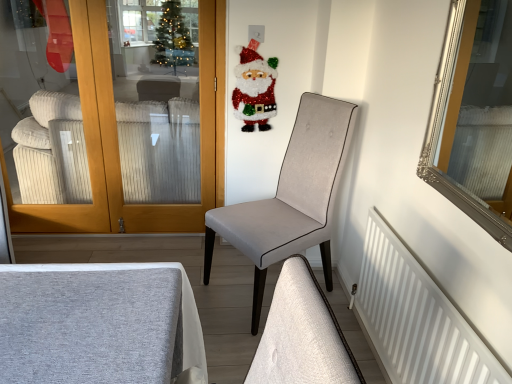
Question: Considering the relative sizes of white ribbed fabric couch at left and silver/glass mirror at upper right in the image provided, is white ribbed fabric couch at left taller than silver/glass mirror at upper right?

Choices:
 (A) no
 (B) yes

Answer: (B)

Question: Is the position of white ribbed fabric couch at left more distant than that of silver/glass mirror at upper right?

Choices:
 (A) yes
 (B) no

Answer: (A)

Question: Is white ribbed fabric couch at left at the left side of silver/glass mirror at upper right?

Choices:
 (A) yes
 (B) no

Answer: (A)

Question: Is white ribbed fabric couch at left smaller than silver/glass mirror at upper right?

Choices:
 (A) no
 (B) yes

Answer: (A)

Question: From the image's perspective, is white ribbed fabric couch at left below silver/glass mirror at upper right?

Choices:
 (A) yes
 (B) no

Answer: (B)

Question: Is white ribbed fabric couch at left beside silver/glass mirror at upper right?

Choices:
 (A) yes
 (B) no

Answer: (B)

Question: From a real-world perspective, is white matte radiator at lower right beneath silver/glass mirror at upper right?

Choices:
 (A) no
 (B) yes

Answer: (B)

Question: Does white matte radiator at lower right have a larger size compared to silver/glass mirror at upper right?

Choices:
 (A) yes
 (B) no

Answer: (A)

Question: From the image's perspective, is white matte radiator at lower right on top of silver/glass mirror at upper right?

Choices:
 (A) yes
 (B) no

Answer: (B)

Question: Does white matte radiator at lower right have a lesser height compared to silver/glass mirror at upper right?

Choices:
 (A) yes
 (B) no

Answer: (B)

Question: Would you say white matte radiator at lower right is outside silver/glass mirror at upper right?

Choices:
 (A) yes
 (B) no

Answer: (A)

Question: Considering the relative sizes of white matte radiator at lower right and silver/glass mirror at upper right in the image provided, is white matte radiator at lower right taller than silver/glass mirror at upper right?

Choices:
 (A) no
 (B) yes

Answer: (B)

Question: Is light gray fabric chair at center next to glittery santa claus at upper center and touching it?

Choices:
 (A) yes
 (B) no

Answer: (B)